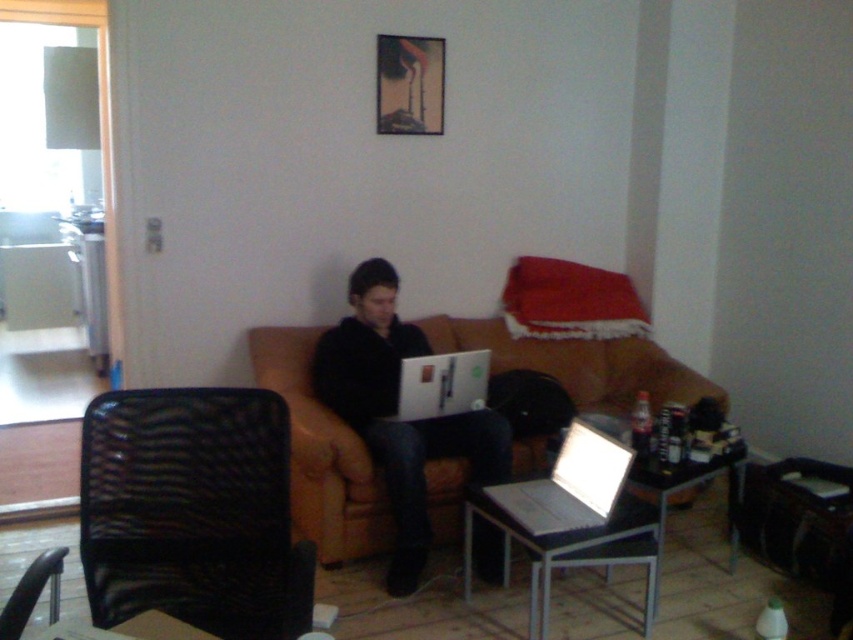
Is brown leather couch at center to the left of black matte laptop at center from the viewer's perspective?

Correct, you'll find brown leather couch at center to the left of black matte laptop at center.

Is point (340, 529) closer to camera compared to point (390, 464)?

No, it is behind (390, 464).

Which is behind, point (351, 532) or point (370, 387)?

The point (370, 387) is behind.

Find the location of a particular element. This screenshot has height=640, width=853. brown leather couch at center is located at coordinates (322, 454).

Does point (399, 541) lie in front of point (625, 467)?

No, (399, 541) is further to viewer.

Which of these two, black matte laptop at center or silver metallic laptop at lower center, stands shorter?

Standing shorter between the two is silver metallic laptop at lower center.

Which is in front, point (386, 477) or point (619, 483)?

Point (619, 483) is in front.

The width and height of the screenshot is (853, 640). In order to click on black matte laptop at center in this screenshot , I will do `click(393, 412)`.

From the picture: Who is taller, black mesh chair at left or black matte laptop at center?

black matte laptop at center is taller.

Between point (134, 531) and point (320, 339), which one is positioned behind?

The point (320, 339) is behind.

Identify the location of black mesh chair at left. (192, 512).